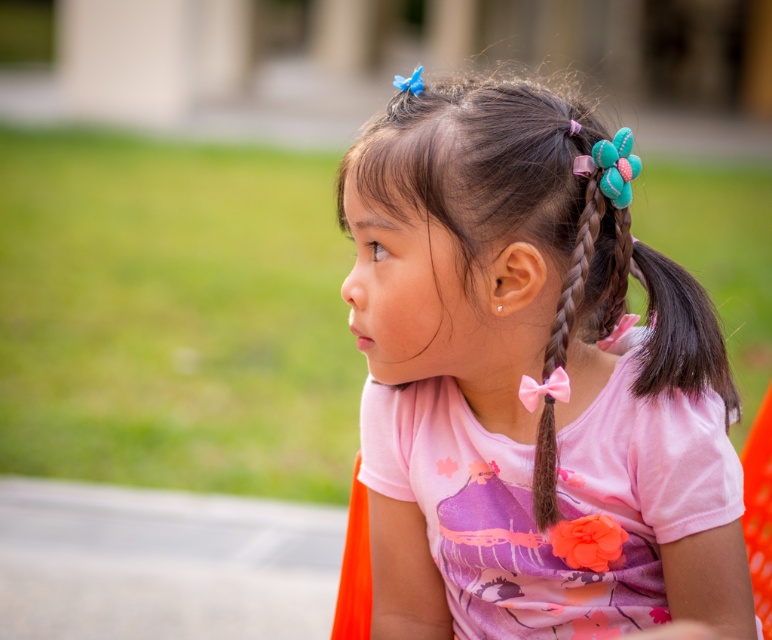
Question: Which of the following is the closest to the observer?

Choices:
 (A) (432, 141)
 (B) (550, 422)

Answer: (A)

Question: Is pink fabric shirt at center bigger than pink satin ribbon at right?

Choices:
 (A) no
 (B) yes

Answer: (B)

Question: Can you confirm if pink fabric shirt at center is positioned below pink satin ribbon at right?

Choices:
 (A) yes
 (B) no

Answer: (A)

Question: Which object appears closest to the camera in this image?

Choices:
 (A) pink fabric shirt at center
 (B) pink satin ribbon at right

Answer: (A)

Question: Where is pink fabric shirt at center located in relation to pink satin ribbon at right in the image?

Choices:
 (A) below
 (B) above

Answer: (A)